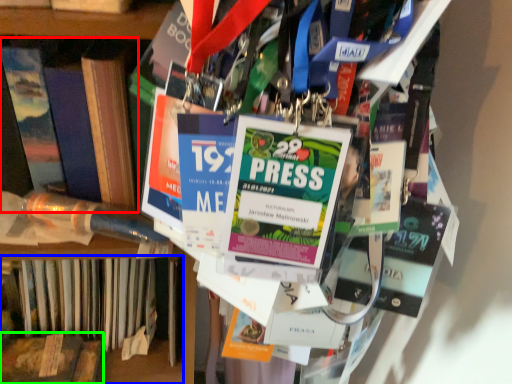
Question: Based on their relative distances, which object is nearer to book (highlighted by a red box)? Choose from book (highlighted by a blue box) and book (highlighted by a green box).

Choices:
 (A) book
 (B) book

Answer: (A)